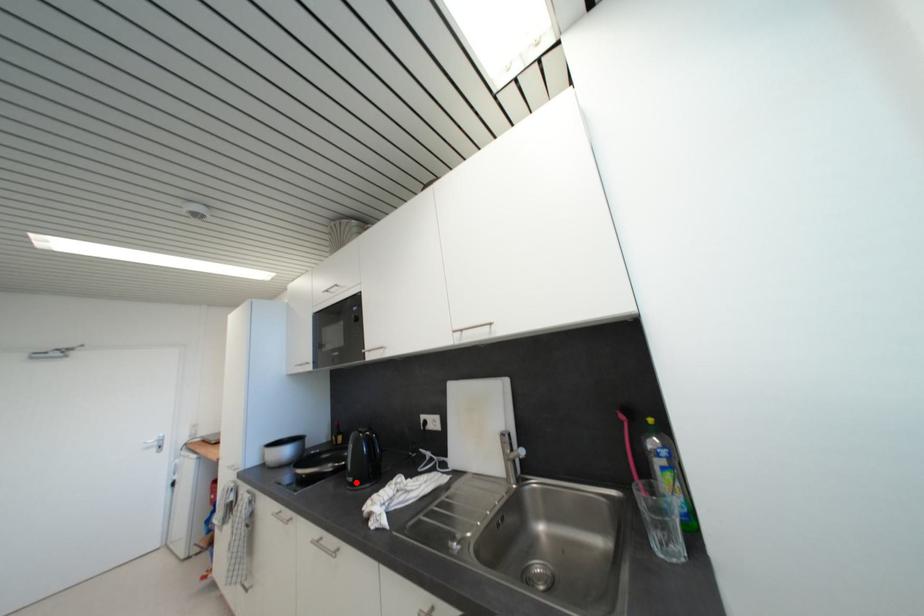
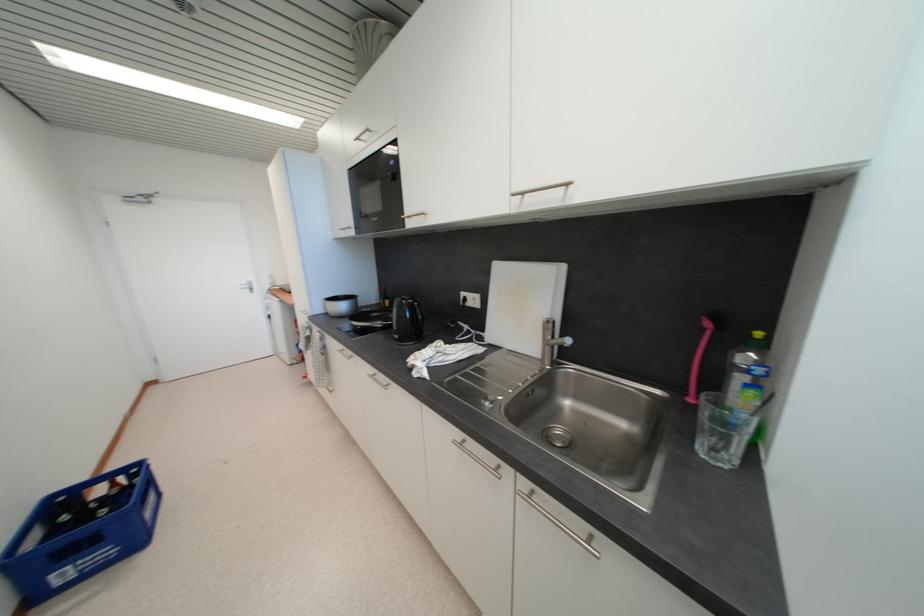
Question: I am providing you with two images of the same scene from different viewpoints. Given a red point in image1, look at the same physical point in image2. Is it:

Choices:
 (A) Closer to the viewpoint
 (B) Farther from the viewpoint

Answer: (A)